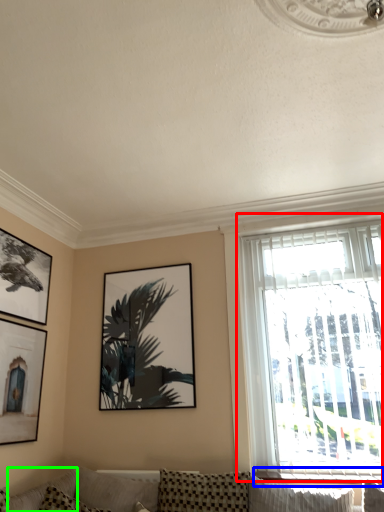
Question: Which object is positioned closest to window (highlighted by a red box)? Select from window sill (highlighted by a blue box) and pillow (highlighted by a green box).

Choices:
 (A) window sill
 (B) pillow

Answer: (A)